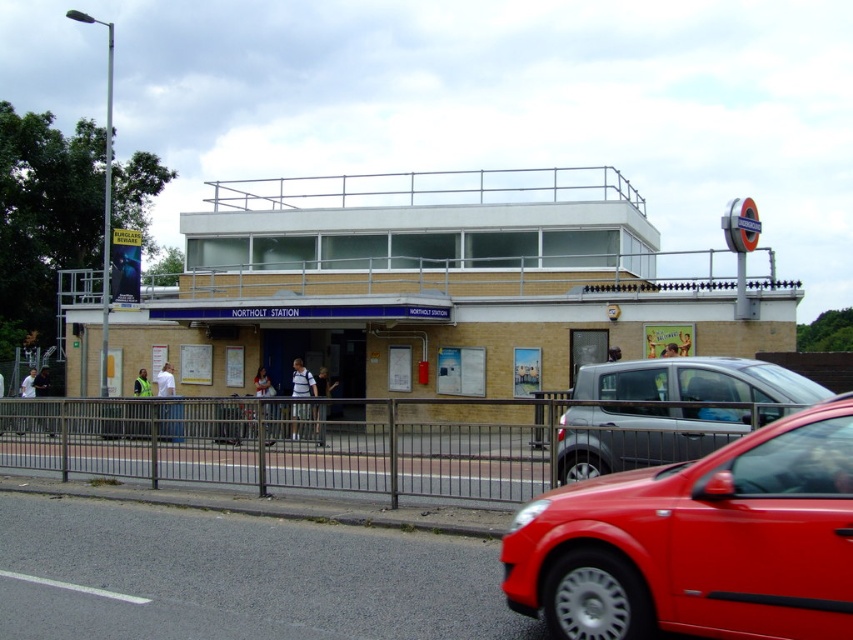
Question: Which is farther from the metallic gray fence at lower center?

Choices:
 (A) silver metallic hatchback at right
 (B) shiny red car at lower right

Answer: (B)

Question: Among these points, which one is farthest from the camera?

Choices:
 (A) (714, 548)
 (B) (595, 406)
 (C) (224, 438)

Answer: (C)

Question: Is metallic gray fence at lower center wider than silver metallic hatchback at right?

Choices:
 (A) no
 (B) yes

Answer: (B)

Question: Does shiny red car at lower right appear under metallic gray fence at lower center?

Choices:
 (A) no
 (B) yes

Answer: (A)

Question: Estimate the real-world distances between objects in this image. Which object is closer to the silver metallic hatchback at right?

Choices:
 (A) shiny red car at lower right
 (B) metallic gray fence at lower center

Answer: (A)

Question: Can you confirm if metallic gray fence at lower center is thinner than silver metallic hatchback at right?

Choices:
 (A) yes
 (B) no

Answer: (B)